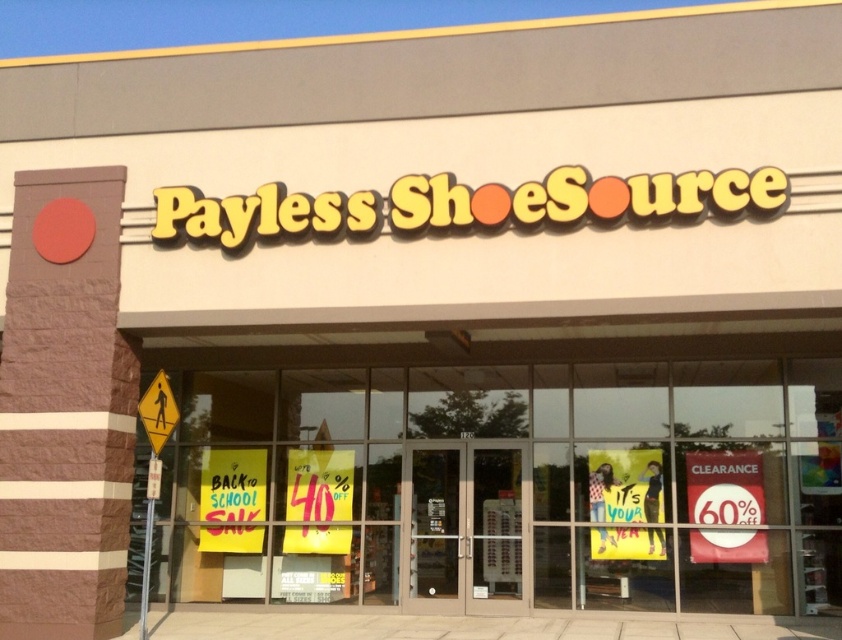
Between yellow glass window at center and red paper sign at lower right, which one has less height?

With less height is red paper sign at lower right.

Does yellow glass window at center have a lesser width compared to red paper sign at lower right?

Incorrect, yellow glass window at center's width is not less than red paper sign at lower right's.

At what (x,y) coordinates should I click in order to perform the action: click on yellow glass window at center. Please return your answer as a coordinate pair (x, y). This screenshot has height=640, width=842. Looking at the image, I should click on (499, 483).

What do you see at coordinates (499, 483) in the screenshot?
I see `yellow glass window at center` at bounding box center [499, 483].

Does yellow glass window at center have a greater width compared to yellow reflective pedestrian crossing sign at lower left?

Yes, yellow glass window at center is wider than yellow reflective pedestrian crossing sign at lower left.

Is point (653, 388) positioned before point (155, 445)?

That is False.

Find the location of a particular element. The image size is (842, 640). yellow glass window at center is located at coordinates (499, 483).

Who is positioned more to the left, red paper sign at lower right or yellow reflective pedestrian crossing sign at lower left?

yellow reflective pedestrian crossing sign at lower left

Who is higher up, red paper sign at lower right or yellow reflective pedestrian crossing sign at lower left?

yellow reflective pedestrian crossing sign at lower left is above.

Does point (720, 472) come closer to viewer compared to point (160, 369)?

Yes, point (720, 472) is in front of point (160, 369).

Find the location of a particular element. The width and height of the screenshot is (842, 640). red paper sign at lower right is located at coordinates (723, 486).